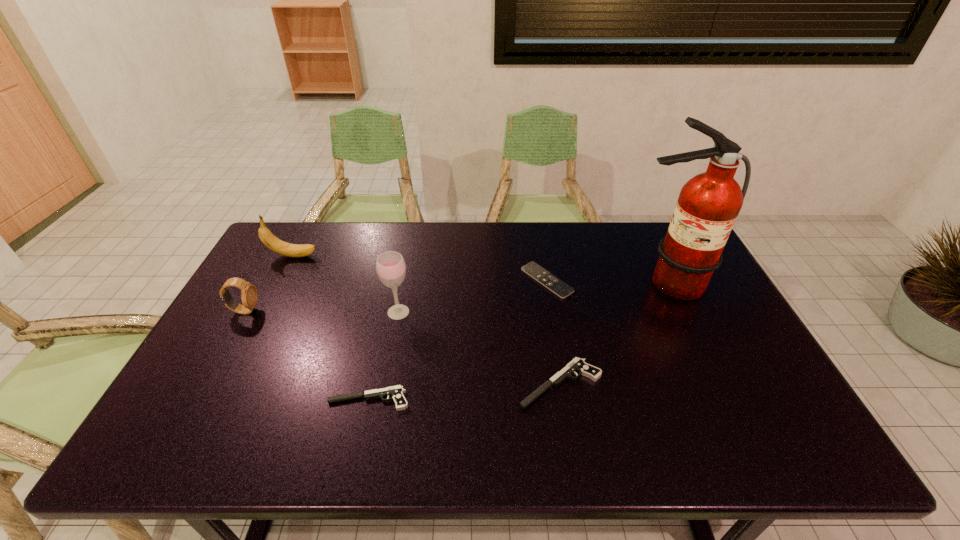
Locate an element on the screen. This screenshot has height=540, width=960. vacant position at the right edge of the desktop is located at coordinates (708, 341).

In the image, there is a desktop. Where is `free space at the far left corner`? The width and height of the screenshot is (960, 540). free space at the far left corner is located at coordinates (287, 227).

Image resolution: width=960 pixels, height=540 pixels. Identify the location of empty space between the tallest object and the third tallest object. (480, 269).

Identify the location of free spot between the wineglass and the fourth tallest object. pos(322,312).

The width and height of the screenshot is (960, 540). What are the coordinates of `unoccupied position between the left pistol and the tallest object` in the screenshot? It's located at (518, 341).

This screenshot has height=540, width=960. I want to click on vacant space in between the taller pistol and the shortest object, so click(x=554, y=332).

Find the location of a particular element. The image size is (960, 540). empty location between the shortest object and the taller pistol is located at coordinates (554, 332).

Where is `free point between the wineglass and the shorter pistol`? The image size is (960, 540). free point between the wineglass and the shorter pistol is located at coordinates point(384,356).

At what (x,y) coordinates should I click in order to perform the action: click on unoccupied area between the third shortest object and the fourth tallest object. Please return your answer as a coordinate pair (x, y). The width and height of the screenshot is (960, 540). Looking at the image, I should click on (402, 347).

Locate an element on the screen. The image size is (960, 540). vacant space that's between the fire extinguisher and the farthest object is located at coordinates (480, 269).